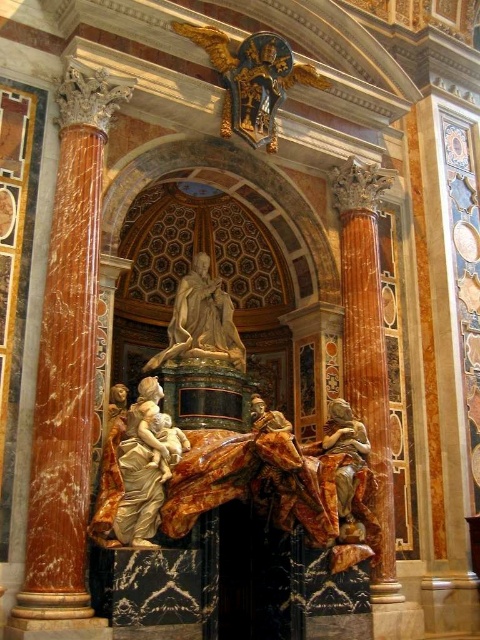
You are an art conservator examining the cathedral interior. You need to assess the placement of the golden marble statue at lower left and the gold leaf angel at upper center. Which object is positioned higher in the image?

The gold leaf angel at upper center is positioned higher than the golden marble statue at lower left.

You are an architect inspecting the cathedral. You notice the marble column at left and the polished marble statue at center. Which object is located directly below the other?

The marble column at left is positioned under the polished marble statue at center, so the marble column at left is directly below the polished marble statue at center.